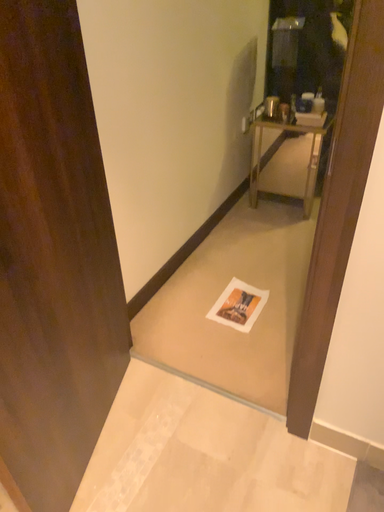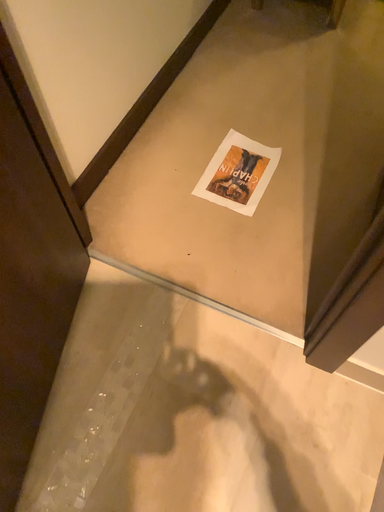
Question: How did the camera likely rotate when shooting the video?

Choices:
 (A) rotated downward
 (B) rotated upward

Answer: (A)